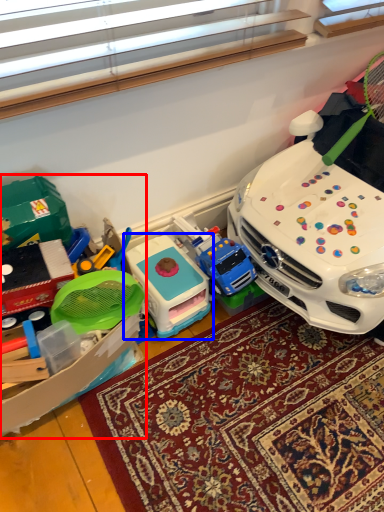
Question: Which point is further to the camera, toy (highlighted by a red box) or toy (highlighted by a blue box)?

Choices:
 (A) toy
 (B) toy

Answer: (B)